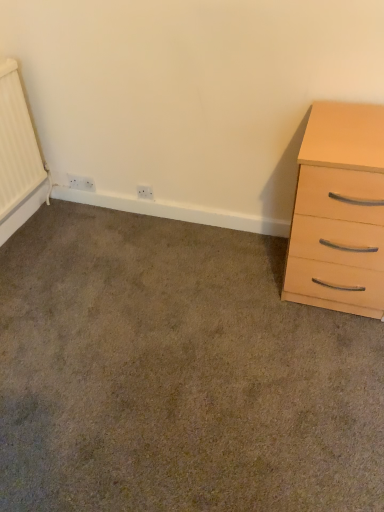
Question: Considering the relative sizes of white plastic electric outlet at center, the 2th electric outlet from the back, and carpet at lower left in the image provided, is white plastic electric outlet at center, the 2th electric outlet from the back, thinner than carpet at lower left?

Choices:
 (A) no
 (B) yes

Answer: (B)

Question: Considering the relative positions of white plastic electric outlet at center, which appears as the 1th electric outlet when viewed from the right, and carpet at lower left in the image provided, is white plastic electric outlet at center, which appears as the 1th electric outlet when viewed from the right, to the right of carpet at lower left from the viewer's perspective?

Choices:
 (A) yes
 (B) no

Answer: (B)

Question: Considering the relative sizes of white plastic electric outlet at center, which appears as the 1th electric outlet when viewed from the right, and carpet at lower left in the image provided, is white plastic electric outlet at center, which appears as the 1th electric outlet when viewed from the right, shorter than carpet at lower left?

Choices:
 (A) yes
 (B) no

Answer: (B)

Question: Is white plastic electric outlet at center, which appears as the second electric outlet when viewed from the left, positioned in front of carpet at lower left?

Choices:
 (A) no
 (B) yes

Answer: (A)

Question: Are white plastic electric outlet at center, which appears as the 1th electric outlet when viewed from the right, and carpet at lower left far apart?

Choices:
 (A) no
 (B) yes

Answer: (A)

Question: Considering the positions of white plastic electric outlet at center, which appears as the second electric outlet when viewed from the left, and light wood/veneer chest of drawers at right in the image, is white plastic electric outlet at center, which appears as the second electric outlet when viewed from the left, wider or thinner than light wood/veneer chest of drawers at right?

Choices:
 (A) thin
 (B) wide

Answer: (A)

Question: Which is correct: white plastic electric outlet at center, the 2th electric outlet from the back, is inside light wood/veneer chest of drawers at right, or outside of it?

Choices:
 (A) inside
 (B) outside

Answer: (B)

Question: Considering the positions of point (152, 198) and point (349, 102), is point (152, 198) closer or farther from the camera than point (349, 102)?

Choices:
 (A) closer
 (B) farther

Answer: (B)

Question: Would you say white plastic electric outlet at center, which appears as the 1th electric outlet when viewed from the right, is to the left or to the right of light wood/veneer chest of drawers at right in the picture?

Choices:
 (A) right
 (B) left

Answer: (B)

Question: In terms of height, does light wood/veneer chest of drawers at right look taller or shorter compared to white plastic electric outlet at center, which appears as the second electric outlet when viewed from the left?

Choices:
 (A) tall
 (B) short

Answer: (A)

Question: Considering the relative positions of light wood/veneer chest of drawers at right and white plastic electric outlet at center, which appears as the second electric outlet when viewed from the left, in the image provided, is light wood/veneer chest of drawers at right to the left or to the right of white plastic electric outlet at center, which appears as the second electric outlet when viewed from the left,?

Choices:
 (A) right
 (B) left

Answer: (A)

Question: From the image's perspective, is light wood/veneer chest of drawers at right located above or below white plastic electric outlet at center, which appears as the second electric outlet when viewed from the left?

Choices:
 (A) below
 (B) above

Answer: (A)

Question: Is point (337, 183) closer or farther from the camera than point (145, 184)?

Choices:
 (A) farther
 (B) closer

Answer: (B)

Question: From the image's perspective, is light wood/veneer chest of drawers at right located above or below white plastic electric outlet at lower left, which appears as the 1th electric outlet when viewed from the back?

Choices:
 (A) above
 (B) below

Answer: (B)

Question: Looking at the image, does light wood/veneer chest of drawers at right seem bigger or smaller compared to white plastic electric outlet at lower left, acting as the second electric outlet starting from the right?

Choices:
 (A) big
 (B) small

Answer: (A)